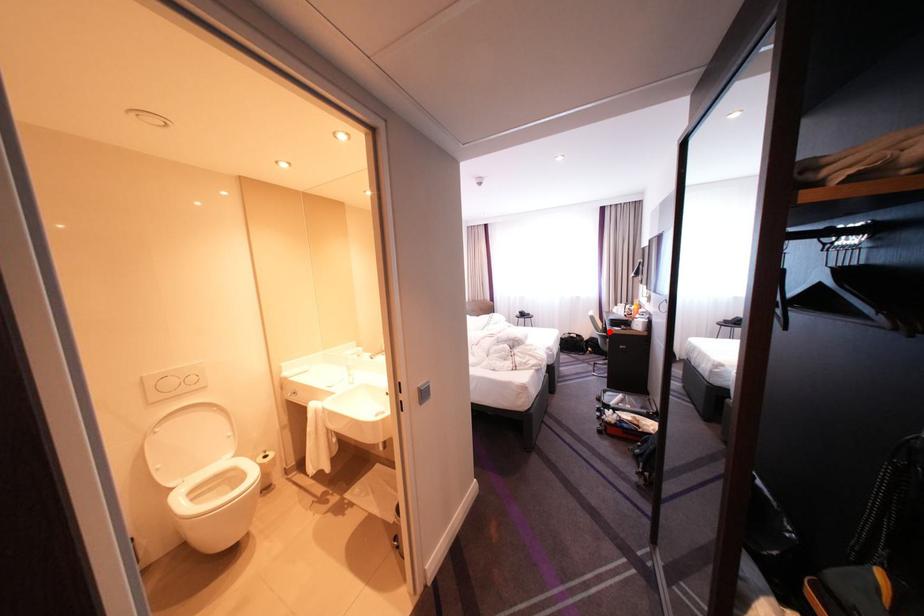
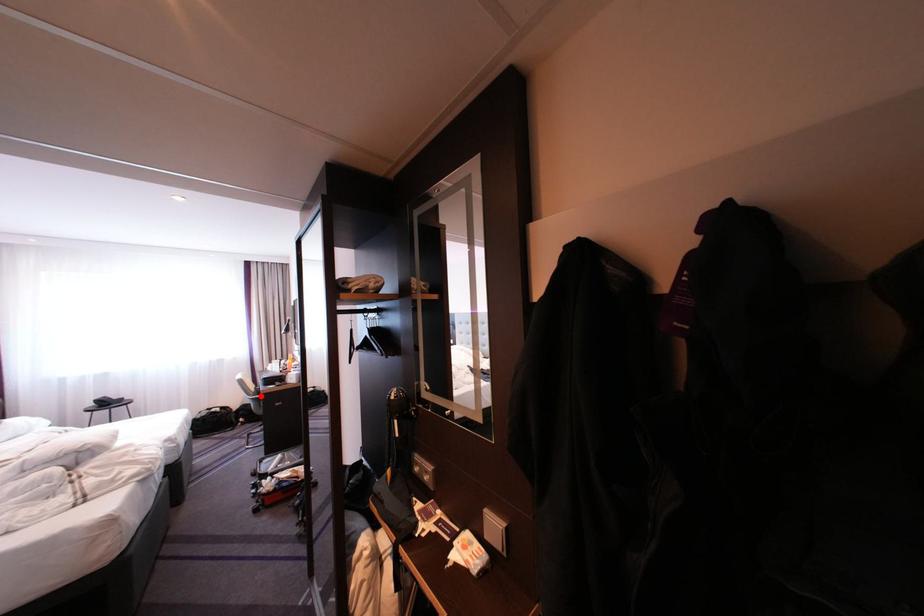
I am providing you with two images of the same scene from different viewpoints. A red point is marked on the first image and another point is marked on the second image. Are the points marked in image1 and image2 representing the same 3D position?

Yes